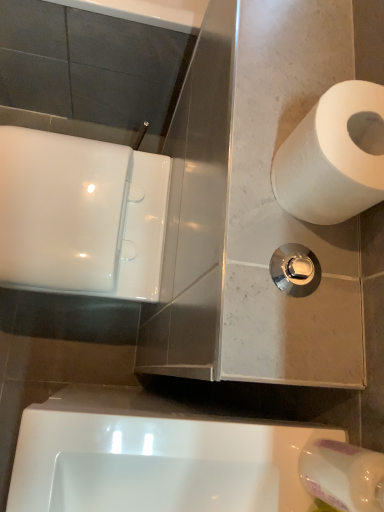
What do you see at coordinates (331, 158) in the screenshot? I see `white paper at right, placed as the second toilet paper when sorted from bottom to top` at bounding box center [331, 158].

This screenshot has width=384, height=512. Identify the location of white glossy urinal at lower center. (154, 456).

The image size is (384, 512). Describe the element at coordinates (154, 456) in the screenshot. I see `white glossy urinal at lower center` at that location.

Measure the distance between point [279,288] and camera.

Point [279,288] is 18.46 inches from camera.

Where is `polished chrome flush handle at center-right`? polished chrome flush handle at center-right is located at coordinates (295, 270).

Locate an element on the screen. This screenshot has height=512, width=384. white paper at right, placed as the second toilet paper when sorted from bottom to top is located at coordinates (331, 158).

Is white matte toilet paper at upper right, the first toilet paper positioned from the bottom, turned away from white paper at right, the 1th toilet paper when ordered from top to bottom?

No, white matte toilet paper at upper right, the first toilet paper positioned from the bottom,'s orientation is not away from white paper at right, the 1th toilet paper when ordered from top to bottom.

From the image's perspective, is white matte toilet paper at upper right, the first toilet paper positioned from the bottom, on white paper at right, placed as the second toilet paper when sorted from bottom to top?

No, from the image's perspective, white matte toilet paper at upper right, the first toilet paper positioned from the bottom, is not above white paper at right, placed as the second toilet paper when sorted from bottom to top.

Considering their positions, is white matte toilet paper at upper right, the second toilet paper in the top-to-bottom sequence, located in front of or behind white paper at right, placed as the second toilet paper when sorted from bottom to top?

Visually, white matte toilet paper at upper right, the second toilet paper in the top-to-bottom sequence, is located in front of white paper at right, placed as the second toilet paper when sorted from bottom to top.

Consider the image. Based on their sizes in the image, would you say white glossy urinal at lower center is bigger or smaller than white paper at right, placed as the second toilet paper when sorted from bottom to top?

In the image, white glossy urinal at lower center appears to be larger than white paper at right, placed as the second toilet paper when sorted from bottom to top.

Measure the distance between white glossy urinal at lower center and white paper at right, the 1th toilet paper when ordered from top to bottom.

white glossy urinal at lower center and white paper at right, the 1th toilet paper when ordered from top to bottom, are 12.43 inches apart.

At what (x,y) coordinates should I click in order to perform the action: click on bath below the white paper at right, placed as the second toilet paper when sorted from bottom to top (from the image's perspective). Please return your answer as a coordinate pair (x, y). Looking at the image, I should click on (154, 456).

Considering the relative positions of white glossy urinal at lower center and white paper at right, placed as the second toilet paper when sorted from bottom to top, in the image provided, is white glossy urinal at lower center to the right of white paper at right, placed as the second toilet paper when sorted from bottom to top, from the viewer's perspective?

No.

From a real-world perspective, between white matte toilet paper at upper right, the first toilet paper positioned from the bottom, and white glossy urinal at lower center, who is vertically lower?

white glossy urinal at lower center is physically lower.

From the picture: From the image's perspective, which object appears higher, white matte toilet paper at upper right, the first toilet paper positioned from the bottom, or white glossy urinal at lower center?

white matte toilet paper at upper right, the first toilet paper positioned from the bottom, is shown above in the image.

Is white matte toilet paper at upper right, the first toilet paper positioned from the bottom, positioned with its back to white glossy urinal at lower center?

No, white matte toilet paper at upper right, the first toilet paper positioned from the bottom,'s orientation is not away from white glossy urinal at lower center.

Who is smaller, white matte toilet paper at upper right, the second toilet paper in the top-to-bottom sequence, or white glossy urinal at lower center?

white matte toilet paper at upper right, the second toilet paper in the top-to-bottom sequence, is smaller.

Is the surface of white glossy urinal at lower center in direct contact with polished chrome flush handle at center-right?

white glossy urinal at lower center and polished chrome flush handle at center-right are clearly separated.

Which object is further away from the camera, white glossy urinal at lower center or polished chrome flush handle at center-right?

Positioned behind is polished chrome flush handle at center-right.

Which object is positioned more to the left, white glossy urinal at lower center or polished chrome flush handle at center-right?

From the viewer's perspective, white glossy urinal at lower center appears more on the left side.

From a real-world perspective, is white glossy urinal at lower center on polished chrome flush handle at center-right?

Actually, white glossy urinal at lower center is physically below polished chrome flush handle at center-right in the real world.

From a real-world perspective, is white matte toilet paper at upper right, the second toilet paper in the top-to-bottom sequence, below polished chrome flush handle at center-right?

No, from a real-world perspective, white matte toilet paper at upper right, the second toilet paper in the top-to-bottom sequence, is not under polished chrome flush handle at center-right.

Which is further, (331, 465) or (290, 265)?

The point (290, 265) is farther from the camera.

Is white matte toilet paper at upper right, the first toilet paper positioned from the bottom, at the right side of polished chrome flush handle at center-right?

Indeed, white matte toilet paper at upper right, the first toilet paper positioned from the bottom, is positioned on the right side of polished chrome flush handle at center-right.

Is white matte toilet paper at upper right, the first toilet paper positioned from the bottom, thinner than polished chrome flush handle at center-right?

Indeed, white matte toilet paper at upper right, the first toilet paper positioned from the bottom, has a lesser width compared to polished chrome flush handle at center-right.

Where is `bath behind the white paper at right, placed as the second toilet paper when sorted from bottom to top`? This screenshot has height=512, width=384. bath behind the white paper at right, placed as the second toilet paper when sorted from bottom to top is located at coordinates (154, 456).

Is white glossy urinal at lower center located within white paper at right, the 1th toilet paper when ordered from top to bottom?

That's incorrect, white glossy urinal at lower center is not inside white paper at right, the 1th toilet paper when ordered from top to bottom.

From the image's perspective, would you say white paper at right, placed as the second toilet paper when sorted from bottom to top, is shown under white glossy urinal at lower center?

No, from the image's perspective, white paper at right, placed as the second toilet paper when sorted from bottom to top, is not beneath white glossy urinal at lower center.

Is polished chrome flush handle at center-right in front of or behind white paper at right, placed as the second toilet paper when sorted from bottom to top, in the image?

polished chrome flush handle at center-right is positioned farther from the viewer than white paper at right, placed as the second toilet paper when sorted from bottom to top.

Does point (282, 289) lie in front of point (304, 154)?

No, (282, 289) is behind (304, 154).

Is there a large distance between polished chrome flush handle at center-right and white paper at right, the 1th toilet paper when ordered from top to bottom?

That's not correct — polished chrome flush handle at center-right is a little close to white paper at right, the 1th toilet paper when ordered from top to bottom.

From the image's perspective, is polished chrome flush handle at center-right above or below white paper at right, the 1th toilet paper when ordered from top to bottom?

Clearly, from the image's perspective, polished chrome flush handle at center-right is below white paper at right, the 1th toilet paper when ordered from top to bottom.

The width and height of the screenshot is (384, 512). I want to click on toilet paper that appears in front of the white paper at right, placed as the second toilet paper when sorted from bottom to top, so click(343, 475).

What are the coordinates of `toilet paper that is the 2nd one above the white glossy urinal at lower center (from a real-world perspective)` in the screenshot? It's located at (331, 158).

Looking at the image, which one is located closer to white glossy urinal at lower center, polished chrome flush handle at center-right or white paper at right, placed as the second toilet paper when sorted from bottom to top?

polished chrome flush handle at center-right.

From the image, which object appears to be farther from white matte toilet paper at upper right, the first toilet paper positioned from the bottom, white glossy urinal at lower center or white paper at right, the 1th toilet paper when ordered from top to bottom?

The object further to white matte toilet paper at upper right, the first toilet paper positioned from the bottom, is white paper at right, the 1th toilet paper when ordered from top to bottom.

Based on their spatial positions, is white glossy urinal at lower center or white matte toilet paper at upper right, the first toilet paper positioned from the bottom, further from white paper at right, placed as the second toilet paper when sorted from bottom to top?

Among the two, white glossy urinal at lower center is located further to white paper at right, placed as the second toilet paper when sorted from bottom to top.

Considering their positions, is white glossy urinal at lower center positioned closer to polished chrome flush handle at center-right than white matte toilet paper at upper right, the first toilet paper positioned from the bottom?

white matte toilet paper at upper right, the first toilet paper positioned from the bottom.

Estimate the real-world distances between objects in this image. Which object is further from white paper at right, placed as the second toilet paper when sorted from bottom to top, polished chrome flush handle at center-right or white matte toilet paper at upper right, the first toilet paper positioned from the bottom?

white matte toilet paper at upper right, the first toilet paper positioned from the bottom, is positioned further to the anchor white paper at right, placed as the second toilet paper when sorted from bottom to top.

From the image, which object appears to be farther from polished chrome flush handle at center-right, white matte toilet paper at upper right, the first toilet paper positioned from the bottom, or white paper at right, the 1th toilet paper when ordered from top to bottom?

white matte toilet paper at upper right, the first toilet paper positioned from the bottom, is further to polished chrome flush handle at center-right.

From the picture: Which object lies further to the anchor point white matte toilet paper at upper right, the second toilet paper in the top-to-bottom sequence, polished chrome flush handle at center-right or white paper at right, the 1th toilet paper when ordered from top to bottom?

white paper at right, the 1th toilet paper when ordered from top to bottom.

Considering their positions, is polished chrome flush handle at center-right positioned closer to white paper at right, the 1th toilet paper when ordered from top to bottom, than white glossy urinal at lower center?

polished chrome flush handle at center-right is closer to white paper at right, the 1th toilet paper when ordered from top to bottom.

This screenshot has width=384, height=512. What are the coordinates of `toilet paper between polished chrome flush handle at center-right and white glossy urinal at lower center in the up-down direction` in the screenshot? It's located at (343, 475).

Where is `plumbing fixture between white paper at right, placed as the second toilet paper when sorted from bottom to top, and white glossy urinal at lower center vertically`? Image resolution: width=384 pixels, height=512 pixels. plumbing fixture between white paper at right, placed as the second toilet paper when sorted from bottom to top, and white glossy urinal at lower center vertically is located at coordinates (295, 270).

Locate an element on the screen. The height and width of the screenshot is (512, 384). plumbing fixture between white paper at right, the 1th toilet paper when ordered from top to bottom, and white matte toilet paper at upper right, the first toilet paper positioned from the bottom, vertically is located at coordinates (295, 270).

This screenshot has width=384, height=512. Identify the location of toilet paper that lies between white paper at right, placed as the second toilet paper when sorted from bottom to top, and white glossy urinal at lower center from top to bottom. click(x=343, y=475).